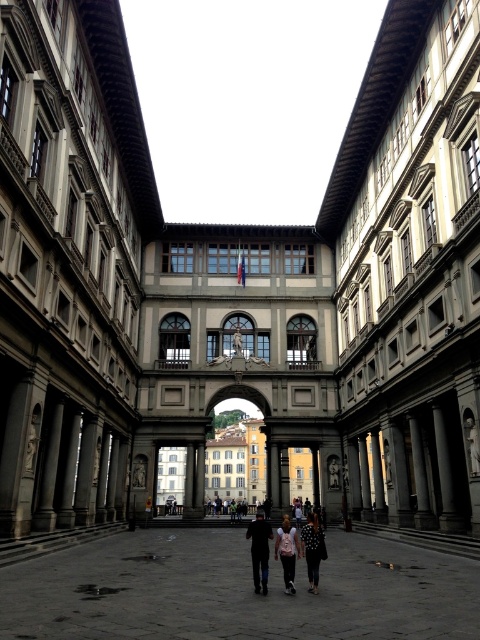
You are a visitor in the courtyard and want to take a photo of both the dark blue jeans at center and the pink fabric dress at center. However, you can only focus on one object at a time. Which object should you focus on to ensure the other is still in the background?

You should focus on the dark blue jeans at center because it is positioned over the pink fabric dress at center, meaning the pink fabric dress at center will be in the background and still visible.

You are a photographer planning to capture a group photo of two people wearing dark blue jeans at center and pink fabric dress at center in the courtyard. Considering their sizes, which person should you position closer to the camera to make them appear the same size in the photo?

Since the dark blue jeans at center is smaller in size compared to the pink fabric dress at center, you should position the person wearing dark blue jeans at center closer to the camera. This way, the smaller subject will appear larger in the frame, balancing their sizes with the person in the pink fabric dress at center.